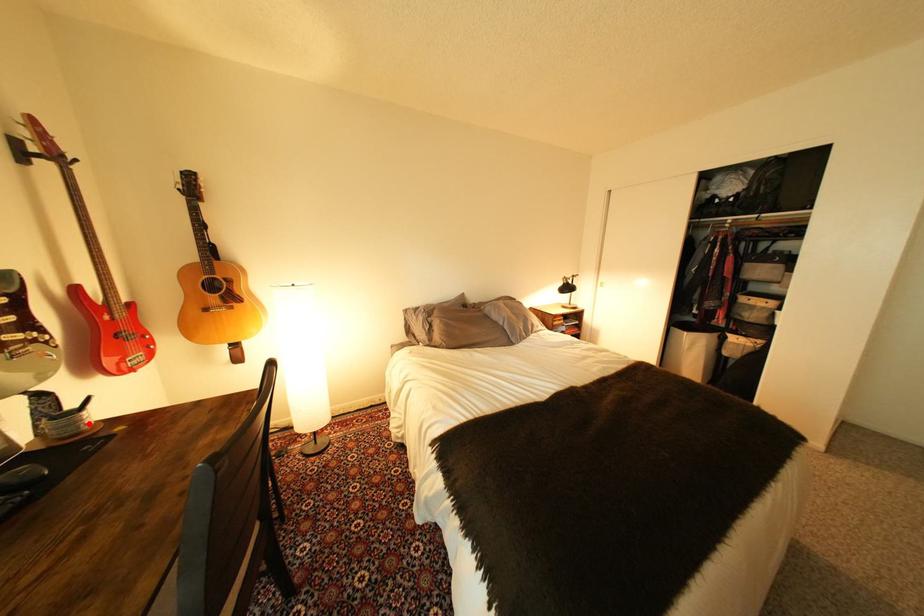
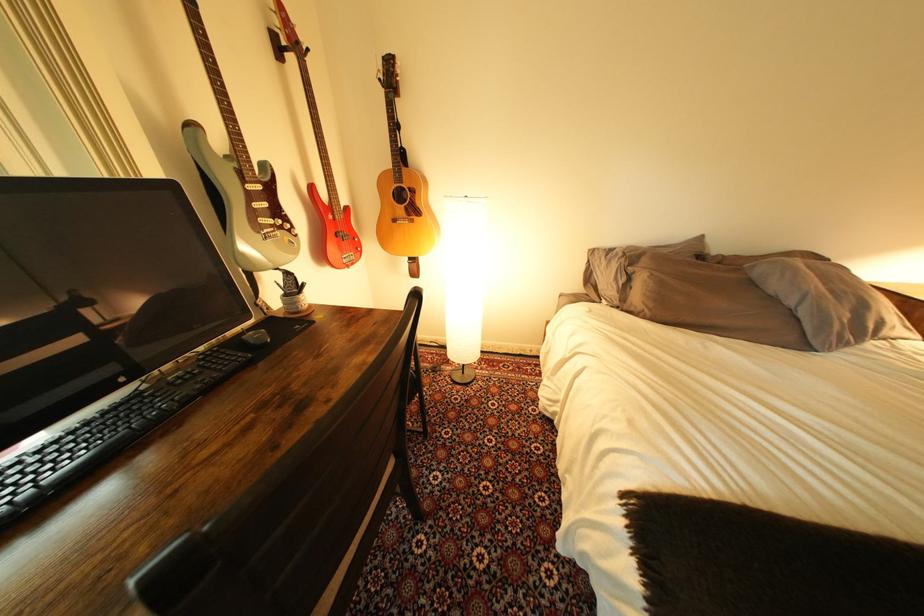
Question: I am providing you with two images of the same scene from different viewpoints. In image1, a red point is highlighted. Considering the same 3D point in image2, which of the following is correct?

Choices:
 (A) It is closer
 (B) It is farther

Answer: (A)